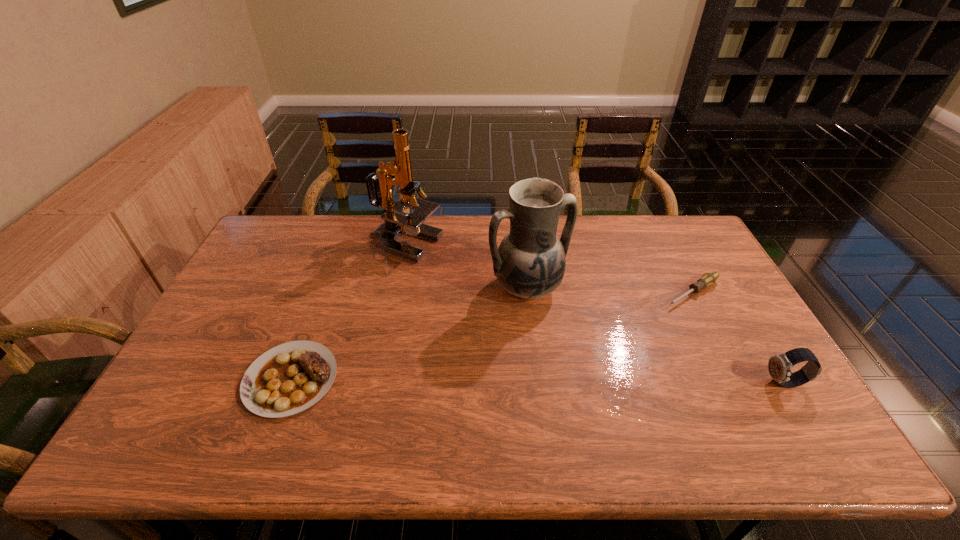
At what (x,y) coordinates should I click in order to perform the action: click on vacant space on the desktop that is between the steak and the watch and is positioned on the front-facing side of the third object from left to right. Please return your answer as a coordinate pair (x, y). Looking at the image, I should click on (597, 381).

The image size is (960, 540). I want to click on vacant space on the desktop that is between the steak and the third shortest object and is positioned at the eyepiece of the microscope, so click(x=566, y=381).

Locate an element on the screen. Image resolution: width=960 pixels, height=540 pixels. free space on the desktop that is between the steak and the third tallest object and is positioned at the tip of the screwdriver is located at coordinates (558, 381).